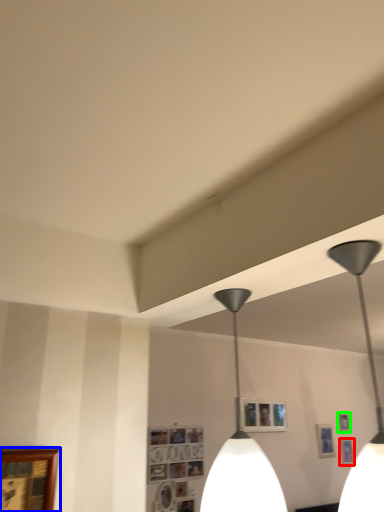
Question: Which is farther away from picture frame (highlighted by a red box)? picture frame (highlighted by a blue box) or picture frame (highlighted by a green box)?

Choices:
 (A) picture frame
 (B) picture frame

Answer: (A)